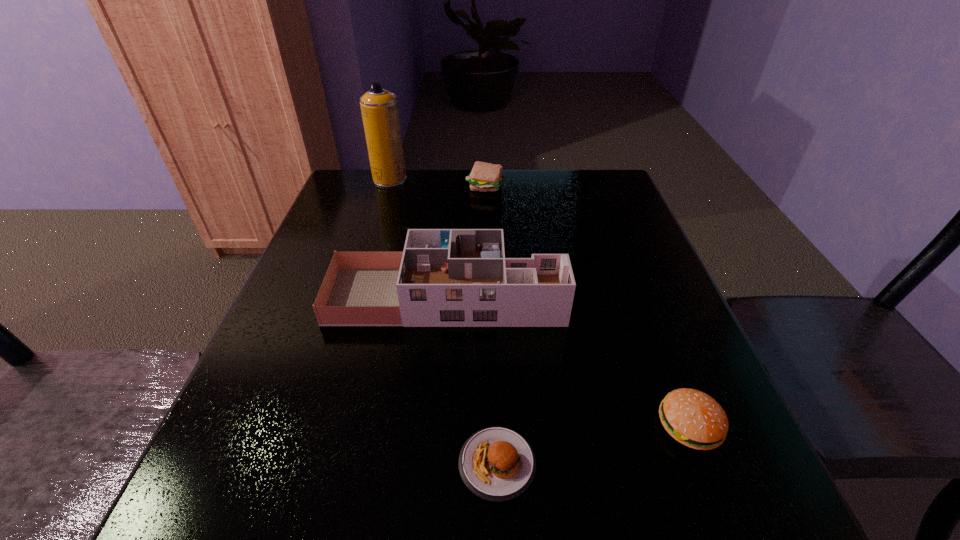
This screenshot has width=960, height=540. I want to click on vacant area at the near edge of the desktop, so [x=444, y=511].

The height and width of the screenshot is (540, 960). In the image, there is a desktop. Find the location of `vacant space at the left edge`. vacant space at the left edge is located at coordinates (264, 345).

This screenshot has height=540, width=960. In order to click on vacant space at the right edge of the desktop in this screenshot , I will do `click(661, 323)`.

This screenshot has width=960, height=540. In the image, there is a desktop. What are the coordinates of `vacant space at the far left corner` in the screenshot? It's located at point(369,185).

This screenshot has width=960, height=540. I want to click on vacant space at the far right corner of the desktop, so click(565, 174).

The height and width of the screenshot is (540, 960). What are the coordinates of `free point at the near right corner` in the screenshot? It's located at (770, 518).

The image size is (960, 540). What are the coordinates of `free spot between the shortest food and the dollhouse` in the screenshot? It's located at (471, 380).

Locate an element on the screen. The width and height of the screenshot is (960, 540). free space between the tallest object and the farthest food is located at coordinates (x=437, y=183).

You are a GUI agent. You are given a task and a screenshot of the screen. Output one action in this format:
    pyautogui.click(x=<x>, y=<y>)
    Task: Click on the vacant area between the fourth shortest object and the rightmost food
    
    Given the screenshot: What is the action you would take?
    pyautogui.click(x=567, y=361)

Identify the location of free space between the rightmost food and the shortest food. (593, 445).